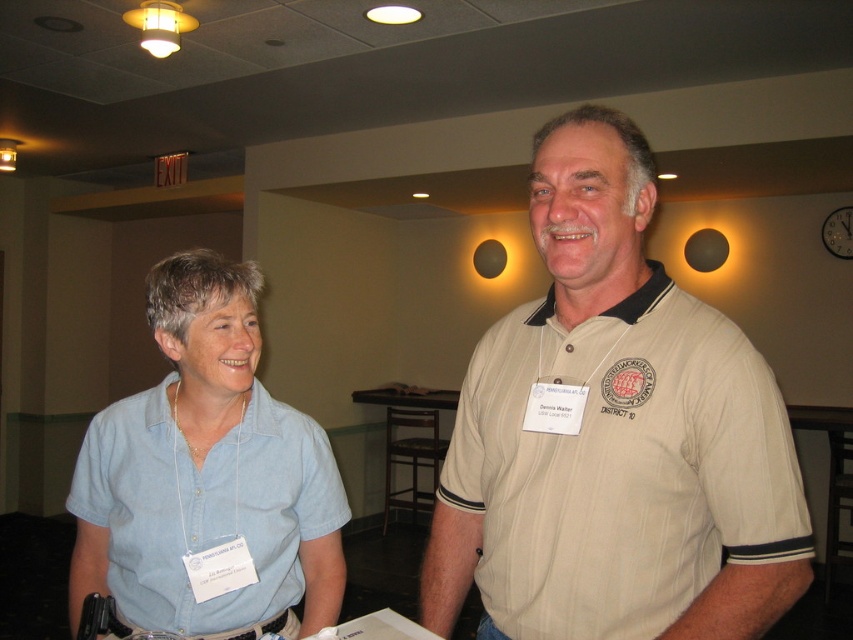
Question: Which point appears farthest from the camera in this image?

Choices:
 (A) (149, 620)
 (B) (543, 592)

Answer: (A)

Question: Which of the following is the farthest from the observer?

Choices:
 (A) beige striped polo shirt at center
 (B) light blue shirt at left

Answer: (B)

Question: Is beige striped polo shirt at center below light blue shirt at left?

Choices:
 (A) yes
 (B) no

Answer: (B)

Question: Where is beige striped polo shirt at center located in relation to light blue shirt at left in the image?

Choices:
 (A) above
 (B) below

Answer: (A)

Question: Where is beige striped polo shirt at center located in relation to light blue shirt at left in the image?

Choices:
 (A) left
 (B) right

Answer: (B)